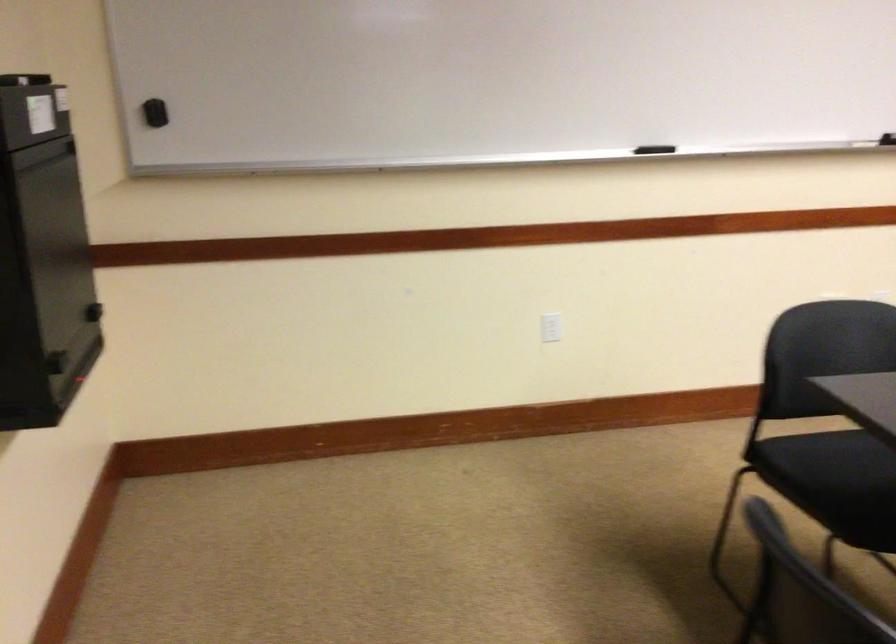
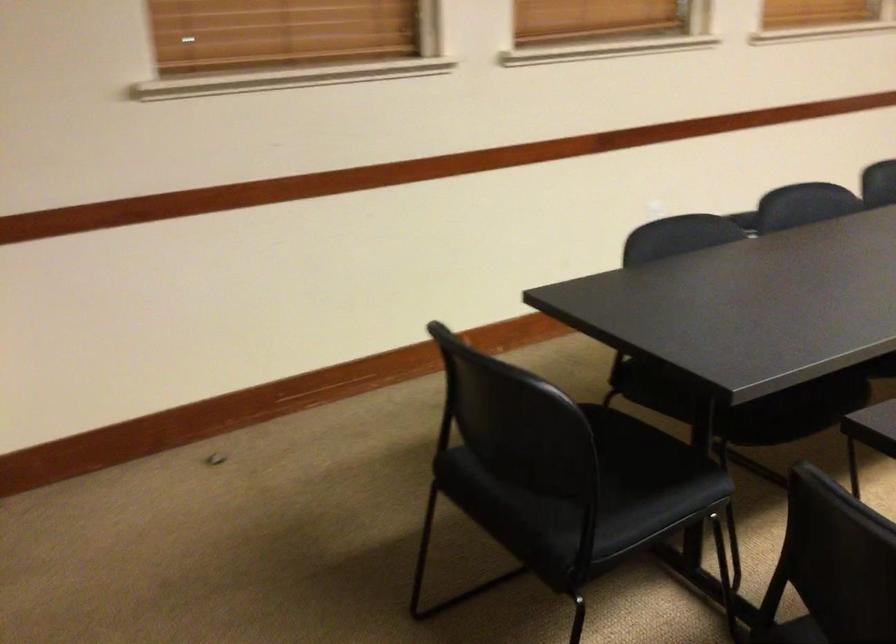
Based on the continuous images, in which direction is the camera rotating?

The rotation direction of the camera is right-down.